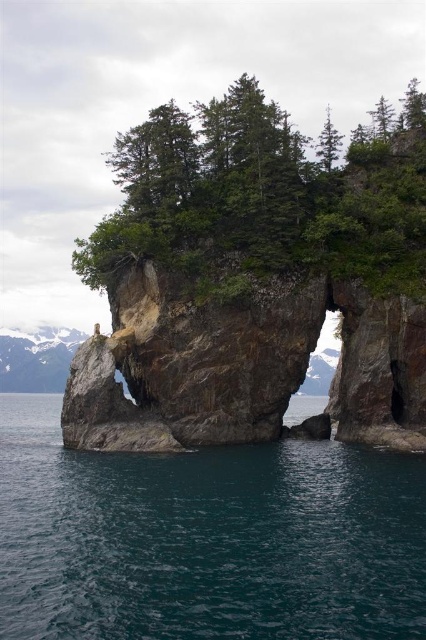
Question: Which point is closer to the camera?

Choices:
 (A) teal glossy water at center
 (B) green matte tree at upper center

Answer: (A)

Question: Among these objects, which one is nearest to the camera?

Choices:
 (A) green matte tree at upper center
 (B) green matte tree at upper right

Answer: (A)

Question: Where is green rough rock at upper center located in relation to green matte tree at upper center in the image?

Choices:
 (A) left
 (B) right

Answer: (B)

Question: Which object appears closest to the camera in this image?

Choices:
 (A) green rough rock at upper center
 (B) teal glossy water at center
 (C) green matte tree at upper center
 (D) green matte tree at upper right

Answer: (B)

Question: Can you confirm if green rough rock at upper center is positioned below green matte tree at upper center?

Choices:
 (A) no
 (B) yes

Answer: (A)

Question: Is green rough rock at upper center thinner than green matte tree at upper center?

Choices:
 (A) yes
 (B) no

Answer: (B)